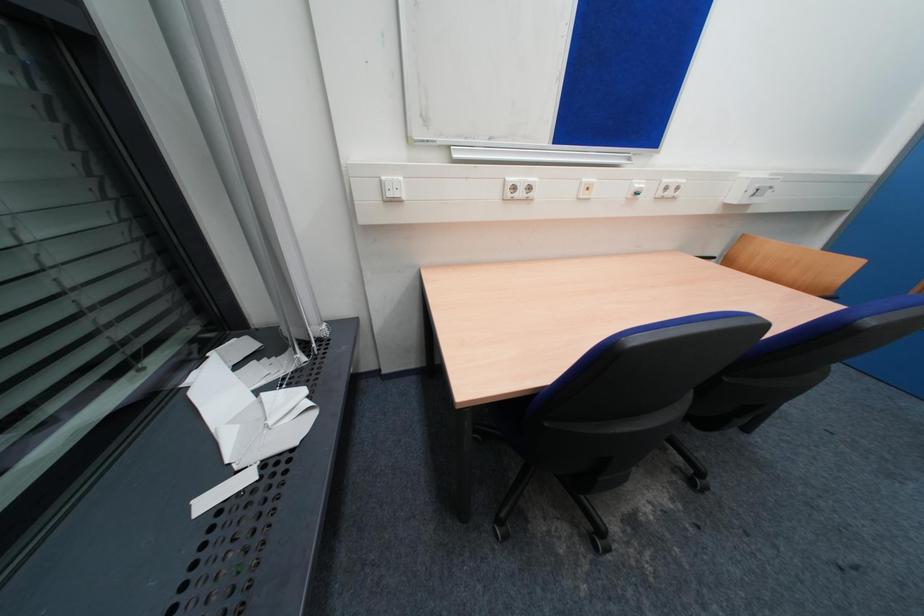
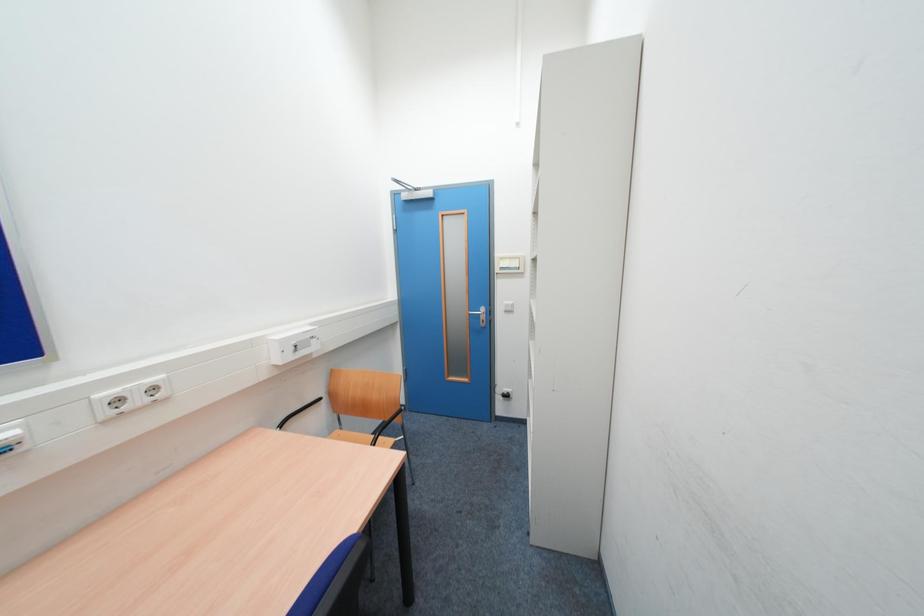
Question: The camera is either moving clockwise (left) or counter-clockwise (right) around the object. The first image is from the beginning of the video and the second image is from the end. Is the camera moving left or right when shooting the video?

Choices:
 (A) Left
 (B) Right

Answer: (A)